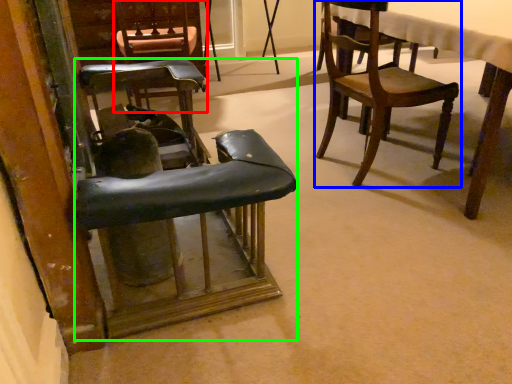
Question: Which object is positioned closest to chair (highlighted by a red box)? Select from chair (highlighted by a blue box) and chair (highlighted by a green box).

Choices:
 (A) chair
 (B) chair

Answer: (A)